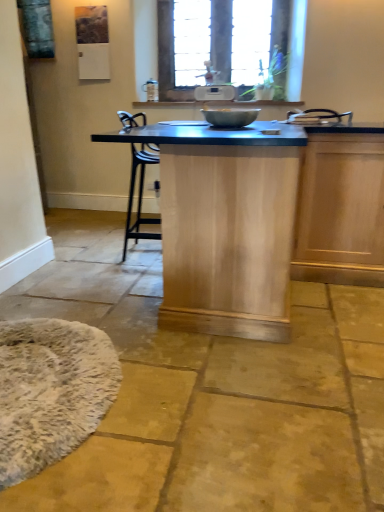
Locate an element on the screen. vacant space behind white fluffy mat at lower left is located at coordinates (92, 306).